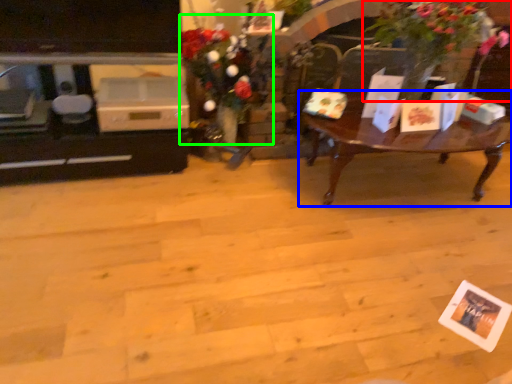
Question: Which object is positioned closest to houseplant (highlighted by a red box)? Select from coffee table (highlighted by a blue box) and floral arrangement (highlighted by a green box).

Choices:
 (A) coffee table
 (B) floral arrangement

Answer: (A)